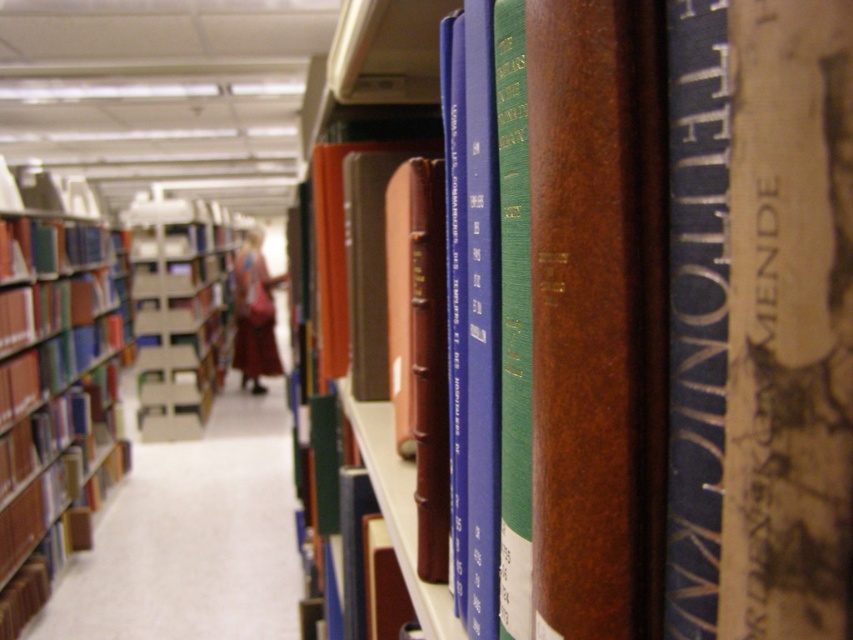
Question: Which of the following is the farthest from the observer?

Choices:
 (A) matte cardboard bookcase at center
 (B) brown leather book at center
 (C) brown leather bookcase at left

Answer: (A)

Question: Does brown leather book at center appear under matte cardboard bookcase at center?

Choices:
 (A) no
 (B) yes

Answer: (B)

Question: Which of the following is the closest to the observer?

Choices:
 (A) matte cardboard bookcase at center
 (B) brown leather book at center
 (C) brown leather bookcase at left

Answer: (B)

Question: Which object is the closest to the brown leather bookcase at left?

Choices:
 (A) brown leather book at center
 (B) matte cardboard bookcase at center

Answer: (B)

Question: Does brown leather book at center appear on the right side of matte cardboard bookcase at center?

Choices:
 (A) yes
 (B) no

Answer: (A)

Question: Is brown leather book at center to the left of brown leather bookcase at left from the viewer's perspective?

Choices:
 (A) no
 (B) yes

Answer: (A)